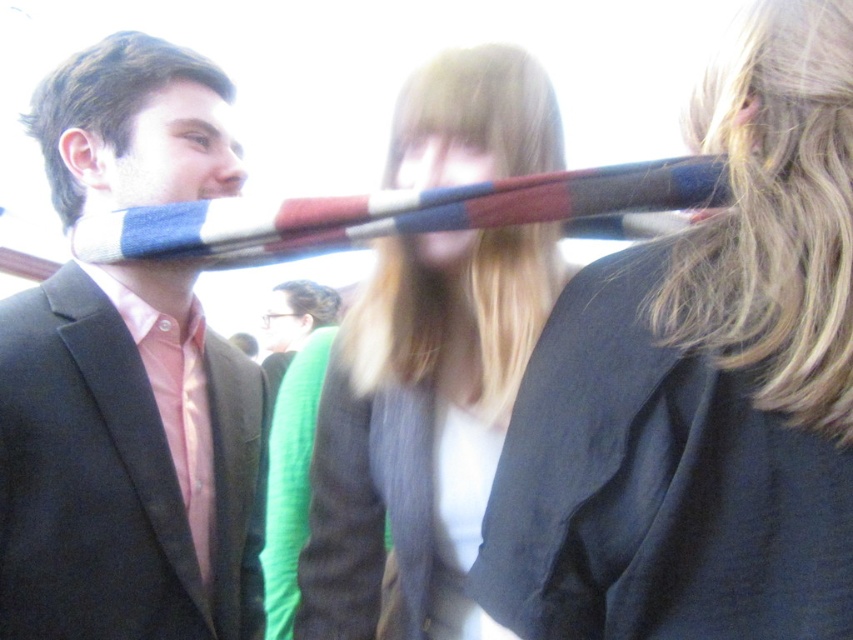
Does dark gray blazer at center appear over matte black suit at left?

Yes, dark gray blazer at center is above matte black suit at left.

Does point (764, 108) come behind point (252, 413)?

That is False.

Identify the location of dark gray blazer at center. (701, 388).

Is the position of blonde hair at center more distant than that of green knit sweater at center?

No.

Which of these two, blonde hair at center or green knit sweater at center, stands taller?

green knit sweater at center

At what (x,y) coordinates should I click in order to perform the action: click on blonde hair at center. Please return your answer as a coordinate pair (x, y). Image resolution: width=853 pixels, height=640 pixels. Looking at the image, I should click on (419, 428).

Find the location of a particular element. Image resolution: width=853 pixels, height=640 pixels. blonde hair at center is located at coordinates (419, 428).

Does matte black suit at left have a larger size compared to blonde hair at center?

Yes.

Does point (102, 380) lie behind point (334, 554)?

No, it is not.

The width and height of the screenshot is (853, 640). What are the coordinates of `matte black suit at left` in the screenshot? It's located at (126, 461).

Image resolution: width=853 pixels, height=640 pixels. In order to click on matte black suit at left in this screenshot , I will do `click(126, 461)`.